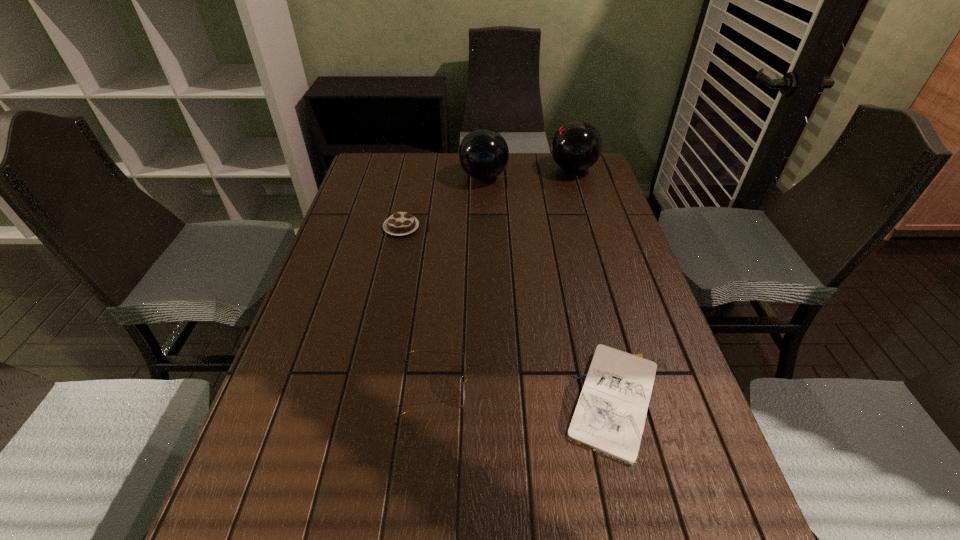
The image size is (960, 540). What are the coordinates of `free space between the spectacles and the second shortest object` in the screenshot? It's located at (419, 307).

I want to click on vacant point located between the spectacles and the left bowling ball, so click(460, 282).

Identify the location of vacant space that's between the leftmost object and the left bowling ball. (443, 202).

I want to click on the fourth closest object to the shortest object, so click(576, 146).

Find the location of `object that can be found as the second closest to the notebook`. object that can be found as the second closest to the notebook is located at coordinates (400, 223).

Locate an element on the screen. free space that satisfies the following two spatial constraints: 1. on the temples of the spectacles; 2. on the right side of the shortest object is located at coordinates [435, 402].

Where is `free region that satisfies the following two spatial constraints: 1. on the temples of the spectacles; 2. on the back side of the shortest object`? free region that satisfies the following two spatial constraints: 1. on the temples of the spectacles; 2. on the back side of the shortest object is located at coordinates (435, 402).

Find the location of a particular element. The width and height of the screenshot is (960, 540). free spot that satisfies the following two spatial constraints: 1. on the back side of the shortest object; 2. on the temples of the spectacles is located at coordinates (611, 388).